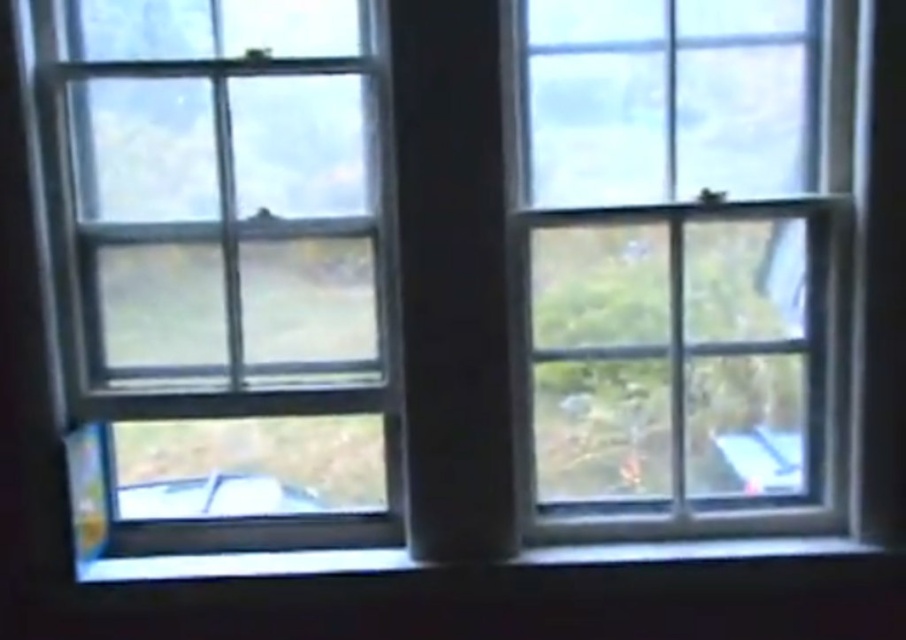
You are standing in a room with two windows side by side. You see a point at coordinates (223,266). Based on the scene description, which window does this point belong to?

The point at coordinates (223,266) belongs to the clear glass window at left as stated in the Objects Description.

You are an interior designer assessing the natural light in a room with two clear glass windows. The clear glass window at left and the clear glass window at center are both important for lighting. Which window has a greater width, and how does this affect the amount of light entering the room?

The clear glass window at left is wider than the clear glass window at center. Since the left window has a greater width, it allows more natural light to enter the room compared to the center window.

You are a window installer and need to replace the glass panes of both the clear glass window at left and the clear glass window at center. If the new panes must match the existing height, which window requires taller panes?

The clear glass window at left requires taller panes because it is taller than the clear glass window at center.